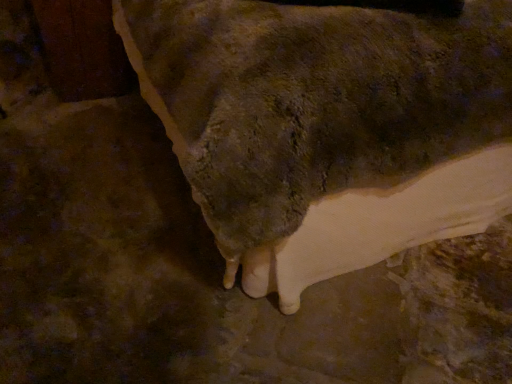
What do you see at coordinates (328, 127) in the screenshot?
I see `smooth stone hand at lower center` at bounding box center [328, 127].

You are a GUI agent. You are given a task and a screenshot of the screen. Output one action in this format:
    pyautogui.click(x=<x>, y=<y>)
    Task: Click on the smooth stone hand at lower center
    The image size is (512, 384).
    Given the screenshot: What is the action you would take?
    pyautogui.click(x=328, y=127)

Locate an element on the screen. This screenshot has width=512, height=384. smooth stone hand at lower center is located at coordinates (328, 127).